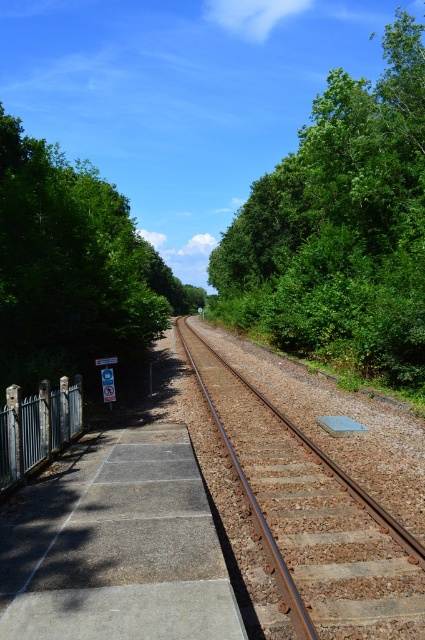
Question: Which point appears farthest from the camera in this image?

Choices:
 (A) (314, 504)
 (B) (28, 333)

Answer: (B)

Question: Is green leafy tree at upper right smaller than white metal fence at left?

Choices:
 (A) no
 (B) yes

Answer: (A)

Question: Among these objects, which one is nearest to the camera?

Choices:
 (A) green leafy tree at left
 (B) white metal fence at left
 (C) green leafy tree at upper right
 (D) rusty metal train track at center

Answer: (D)

Question: Is green leafy tree at left behind white metal fence at left?

Choices:
 (A) no
 (B) yes

Answer: (B)

Question: From the image, what is the correct spatial relationship of green leafy tree at left in relation to white metal fence at left?

Choices:
 (A) left
 (B) right

Answer: (A)

Question: Which object appears closest to the camera in this image?

Choices:
 (A) green leafy tree at upper right
 (B) green leafy tree at left
 (C) white metal fence at left
 (D) rusty metal train track at center

Answer: (D)